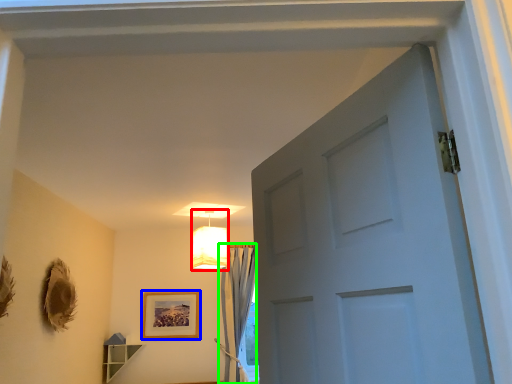
Question: Based on their relative distances, which object is nearer to lamp (highlighted by a red box)? Choose from picture frame (highlighted by a blue box) and curtain (highlighted by a green box).

Choices:
 (A) picture frame
 (B) curtain

Answer: (B)